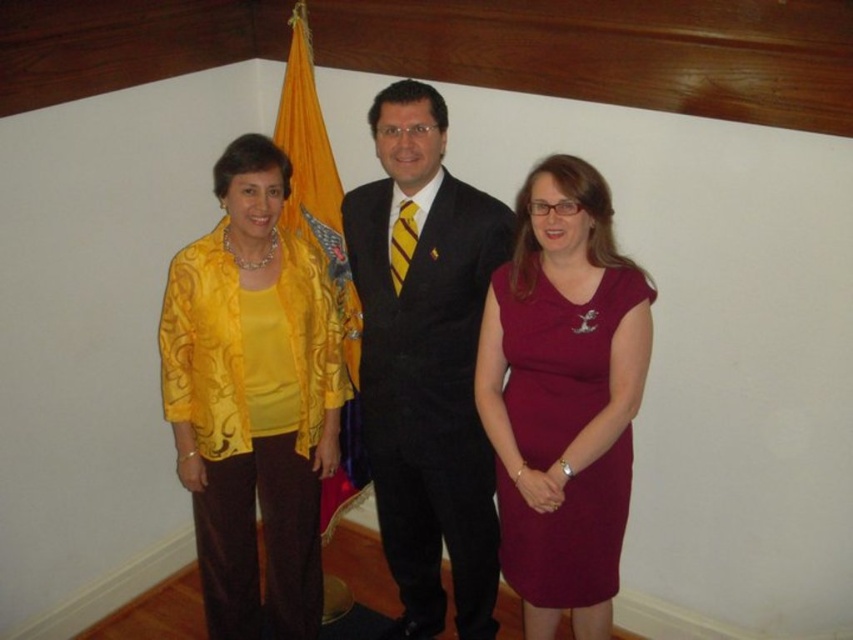
Question: Which object is the farthest from the matte black suit at center?

Choices:
 (A) burgundy satin dress at center
 (B) yellow satin flag at center
 (C) matte yellow blouse at center

Answer: (B)

Question: Where is matte black suit at center located in relation to yellow satin flag at center in the image?

Choices:
 (A) above
 (B) below

Answer: (B)

Question: Which of the following is the farthest from the observer?

Choices:
 (A) (265, 419)
 (B) (374, 404)

Answer: (B)

Question: Which of the following is the farthest from the observer?

Choices:
 (A) (614, 275)
 (B) (398, 252)
 (C) (312, 467)

Answer: (C)

Question: Is matte yellow blouse at center in front of matte black suit at center?

Choices:
 (A) yes
 (B) no

Answer: (A)

Question: Does matte yellow blouse at center have a smaller size compared to matte black suit at center?

Choices:
 (A) no
 (B) yes

Answer: (B)